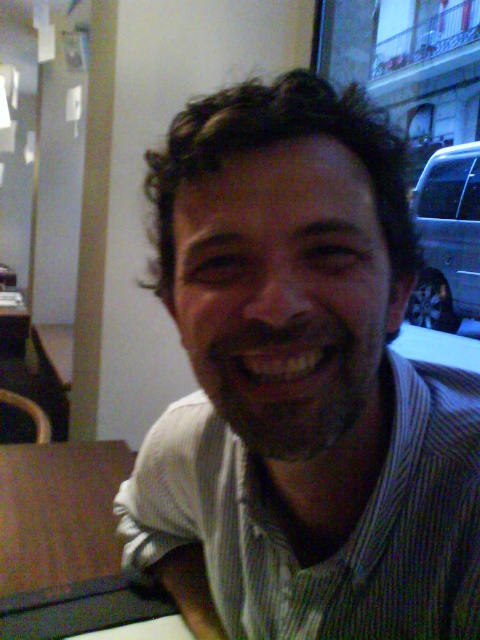
Question: Can you confirm if green striped shirt at center is bigger than brown wood table at left?

Choices:
 (A) no
 (B) yes

Answer: (B)

Question: Among these objects, which one is nearest to the camera?

Choices:
 (A) brown wood table at left
 (B) green striped shirt at center

Answer: (B)

Question: Among these objects, which one is nearest to the camera?

Choices:
 (A) green striped shirt at center
 (B) brown wood table at left

Answer: (A)

Question: Does green striped shirt at center have a smaller size compared to brown wood table at left?

Choices:
 (A) yes
 (B) no

Answer: (B)

Question: Can you confirm if green striped shirt at center is thinner than brown wood table at left?

Choices:
 (A) yes
 (B) no

Answer: (A)